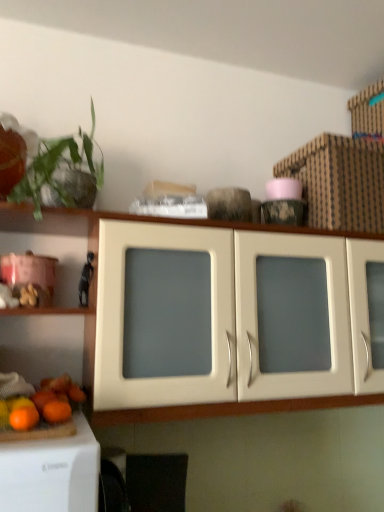
Question: Is green leafy plant at upper left with orange matte at lower left, arranged as the 1th orange when viewed from the back?

Choices:
 (A) yes
 (B) no

Answer: (B)

Question: Is the depth of green leafy plant at upper left greater than that of orange matte at lower left, which is the 2th orange from front to back?

Choices:
 (A) yes
 (B) no

Answer: (B)

Question: Is green leafy plant at upper left surrounding orange matte at lower left, arranged as the 1th orange when viewed from the back?

Choices:
 (A) yes
 (B) no

Answer: (B)

Question: Is green leafy plant at upper left outside orange matte at lower left, which is the 2th orange from front to back?

Choices:
 (A) no
 (B) yes

Answer: (B)

Question: Does green leafy plant at upper left have a greater height compared to orange matte at lower left, arranged as the 1th orange when viewed from the back?

Choices:
 (A) yes
 (B) no

Answer: (A)

Question: Is green leafy plant at upper left looking in the opposite direction of orange matte at lower left, which is the 2th orange from front to back?

Choices:
 (A) yes
 (B) no

Answer: (B)

Question: Is matte white cabinet at center in front of black matte figurine at left?

Choices:
 (A) yes
 (B) no

Answer: (A)

Question: Considering the relative sizes of matte white cabinet at center and black matte figurine at left in the image provided, is matte white cabinet at center taller than black matte figurine at left?

Choices:
 (A) yes
 (B) no

Answer: (A)

Question: Considering the relative sizes of matte white cabinet at center and black matte figurine at left in the image provided, is matte white cabinet at center thinner than black matte figurine at left?

Choices:
 (A) no
 (B) yes

Answer: (A)

Question: From a real-world perspective, is matte white cabinet at center physically above black matte figurine at left?

Choices:
 (A) yes
 (B) no

Answer: (B)

Question: Is matte white cabinet at center facing towards black matte figurine at left?

Choices:
 (A) no
 (B) yes

Answer: (B)

Question: From a real-world perspective, is matte white cabinet at center below black matte figurine at left?

Choices:
 (A) yes
 (B) no

Answer: (A)

Question: Does orange matte at lower left, the 2th orange positioned from the back, touch green leafy plant at upper left?

Choices:
 (A) no
 (B) yes

Answer: (A)